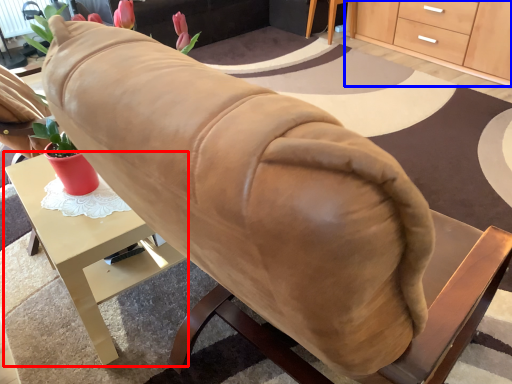
Question: Which object appears farthest to the camera in this image, desk (highlighted by a red box) or cabinetry (highlighted by a blue box)?

Choices:
 (A) desk
 (B) cabinetry

Answer: (B)